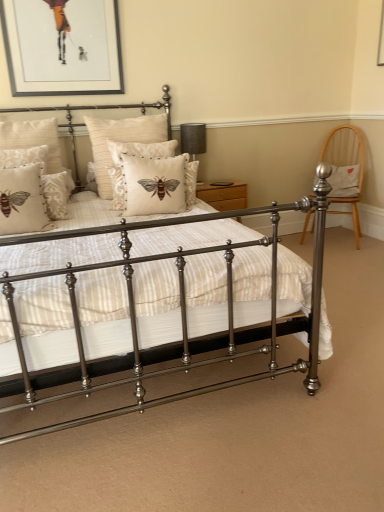
Describe the element at coordinates (120, 141) in the screenshot. This screenshot has height=512, width=384. I see `beige textured pillow with bee design at center, the third pillow positioned from the right` at that location.

Identify the location of beige textured pillow with bee design at center, the third pillow positioned from the right. (120, 141).

Image resolution: width=384 pixels, height=512 pixels. What do you see at coordinates (22, 201) in the screenshot?
I see `beige embroidered pillow at left, which is the fifth pillow from right to left` at bounding box center [22, 201].

This screenshot has height=512, width=384. Find the location of `matte wood nightstand at center`. matte wood nightstand at center is located at coordinates (224, 195).

Between black fabric table lamp at upper center and metallic bed at center, which one has smaller width?

black fabric table lamp at upper center is thinner.

Would you say black fabric table lamp at upper center contains metallic bed at center?

Definitely not — metallic bed at center is not inside black fabric table lamp at upper center.

Based on their positions, is black fabric table lamp at upper center located to the left or right of metallic bed at center?

black fabric table lamp at upper center is positioned on metallic bed at center's right side.

Which is further, (x=66, y=193) or (x=191, y=150)?

Positioned behind is point (x=191, y=150).

Is the depth of matte cream pillow at left, arranged as the 4th pillow when viewed from the right, greater than that of black fabric table lamp at upper center?

No, the depth of matte cream pillow at left, arranged as the 4th pillow when viewed from the right, is less than that of black fabric table lamp at upper center.

Considering the sizes of matte cream pillow at left, arranged as the 4th pillow when viewed from the right, and black fabric table lamp at upper center in the image, is matte cream pillow at left, arranged as the 4th pillow when viewed from the right, wider or thinner than black fabric table lamp at upper center?

In the image, matte cream pillow at left, arranged as the 4th pillow when viewed from the right, appears to be wider than black fabric table lamp at upper center.

Locate an element on the screen. table lamp that is on the right side of matte cream pillow at left, which is counted as the 4th pillow, starting from the left is located at coordinates (193, 139).

Is point (119, 126) positioned after point (242, 197)?

No, (119, 126) is closer to viewer.

Is beige textured pillow with bee design at center, which ranks as the 5th pillow in left-to-right order, completely or partially outside of matte wood nightstand at center?

beige textured pillow with bee design at center, which ranks as the 5th pillow in left-to-right order, is positioned outside matte wood nightstand at center.

Between beige textured pillow with bee design at center, the third pillow positioned from the right, and matte wood nightstand at center, which one appears on the left side from the viewer's perspective?

beige textured pillow with bee design at center, the third pillow positioned from the right.

Is beige textured pillow with bee design at center, the third pillow positioned from the right, beside matte wood nightstand at center?

No, beige textured pillow with bee design at center, the third pillow positioned from the right, is not making contact with matte wood nightstand at center.

From a real-world perspective, which object stands above the other?

beige damask pillow at left, which is the first pillow in left-to-right order, is physically above.

Does point (204, 135) come behind point (18, 134)?

Yes, point (204, 135) is behind point (18, 134).

Would you say black fabric table lamp at upper center is a long distance from beige damask pillow at left, which is the first pillow in left-to-right order?

That's right, there is a large distance between black fabric table lamp at upper center and beige damask pillow at left, which is the first pillow in left-to-right order.

Looking at their sizes, would you say black fabric table lamp at upper center is wider or thinner than beige damask pillow at left, which is the first pillow in left-to-right order?

Clearly, black fabric table lamp at upper center has less width compared to beige damask pillow at left, which is the first pillow in left-to-right order.

Considering the relative positions of black fabric table lamp at upper center and beige embroidered pillow at left, which is the fifth pillow from right to left, in the image provided, is black fabric table lamp at upper center to the right of beige embroidered pillow at left, which is the fifth pillow from right to left, from the viewer's perspective?

Yes.

Which is behind, point (182, 149) or point (0, 205)?

The point (182, 149) is farther from the camera.

From the image's perspective, which is below, black fabric table lamp at upper center or beige embroidered pillow at left, the third pillow viewed from the left?

beige embroidered pillow at left, the third pillow viewed from the left.

Is black fabric table lamp at upper center inside or outside of beige embroidered pillow at left, the third pillow viewed from the left?

The correct answer is: outside.

Is point (196, 191) positioned before point (25, 152)?

No, it is behind (25, 152).

Considering the sizes of objects matte wood nightstand at center and beige textured pillow at left, which is counted as the 2th pillow, starting from the left, in the image provided, who is taller, matte wood nightstand at center or beige textured pillow at left, which is counted as the 2th pillow, starting from the left,?

matte wood nightstand at center.

From the image's perspective, relative to beige textured pillow at left, which is the sixth pillow from right to left, is matte wood nightstand at center above or below?

matte wood nightstand at center is situated lower than beige textured pillow at left, which is the sixth pillow from right to left, in the image.

In the image, is matte wood nightstand at center positioned in front of or behind beige textured pillow at left, which is counted as the 2th pillow, starting from the left?

Clearly, matte wood nightstand at center is behind beige textured pillow at left, which is counted as the 2th pillow, starting from the left.

Is black fabric table lamp at upper center looking in the opposite direction of beige textured pillow at left, which is the sixth pillow from right to left?

No.

Considering the relative positions of black fabric table lamp at upper center and beige textured pillow at left, which is the sixth pillow from right to left, in the image provided, is black fabric table lamp at upper center to the right of beige textured pillow at left, which is the sixth pillow from right to left, from the viewer's perspective?

Correct, you'll find black fabric table lamp at upper center to the right of beige textured pillow at left, which is the sixth pillow from right to left.

Identify the location of the 4th pillow in front of the black fabric table lamp at upper center. The width and height of the screenshot is (384, 512). point(24,157).

You are a GUI agent. You are given a task and a screenshot of the screen. Output one action in this format:
    pyautogui.click(x=<x>, y=<y>)
    Task: Click on the table lamp lying behind the metallic bed at center
    
    Given the screenshot: What is the action you would take?
    pyautogui.click(x=193, y=139)

This screenshot has height=512, width=384. Identify the location of table lamp positioned vertically above the matte cream pillow at left, which is counted as the 4th pillow, starting from the left (from a real-world perspective). (193, 139).

Considering their positions, is beige damask pillow at left, arranged as the seventh pillow when viewed from the right, positioned further to beige embroidered pillow at left, the third pillow viewed from the left, than black fabric table lamp at upper center?

black fabric table lamp at upper center lies further to beige embroidered pillow at left, the third pillow viewed from the left, than the other object.

Looking at the image, which one is located closer to metallic bed at center, white fabric pillow at right, the seventh pillow when ordered from left to right, or matte cream pillow at left, arranged as the 4th pillow when viewed from the right?

Based on the image, matte cream pillow at left, arranged as the 4th pillow when viewed from the right, appears to be nearer to metallic bed at center.

Which object lies nearer to the anchor point beige embroidered pillow at left, the third pillow viewed from the left, matte cream pillow at left, which is counted as the 4th pillow, starting from the left, or metallic bed at center?

The object closer to beige embroidered pillow at left, the third pillow viewed from the left, is matte cream pillow at left, which is counted as the 4th pillow, starting from the left.

Which object lies nearer to the anchor point beige textured pillow with bee design at center, the second pillow when ordered from right to left, beige textured pillow with bee design at center, the third pillow positioned from the right, or matte wood nightstand at center?

The object closer to beige textured pillow with bee design at center, the second pillow when ordered from right to left, is beige textured pillow with bee design at center, the third pillow positioned from the right.

Estimate the real-world distances between objects in this image. Which object is further from wooden chair with cushion at right, black fabric table lamp at upper center or beige embroidered pillow at left, the third pillow viewed from the left?

The object further to wooden chair with cushion at right is beige embroidered pillow at left, the third pillow viewed from the left.

Based on their spatial positions, is beige damask pillow at left, arranged as the seventh pillow when viewed from the right, or matte wood nightstand at center further from beige textured pillow with bee design at center, the sixth pillow positioned from the left?

The object further to beige textured pillow with bee design at center, the sixth pillow positioned from the left, is matte wood nightstand at center.

From the image, which object appears to be nearer to metallic bed at center, black fabric table lamp at upper center or white fabric pillow at right, the seventh pillow when ordered from left to right?

black fabric table lamp at upper center is closer to metallic bed at center.

Based on their spatial positions, is beige damask pillow at left, which is the first pillow in left-to-right order, or white fabric pillow at right, the seventh pillow when ordered from left to right, closer to beige embroidered pillow at left, which is the fifth pillow from right to left?

Among the two, beige damask pillow at left, which is the first pillow in left-to-right order, is located nearer to beige embroidered pillow at left, which is the fifth pillow from right to left.

Identify the location of pillow situated between matte wood nightstand at center and wooden chair with cushion at right from left to right. Image resolution: width=384 pixels, height=512 pixels. (344, 181).

Locate an element on the screen. nightstand between beige textured pillow with bee design at center, the sixth pillow positioned from the left, and wooden chair with cushion at right, in the horizontal direction is located at coordinates (224, 195).

Locate an element on the screen. Image resolution: width=384 pixels, height=512 pixels. table lamp between beige textured pillow with bee design at center, which ranks as the 5th pillow in left-to-right order, and matte wood nightstand at center, along the z-axis is located at coordinates (193, 139).

The height and width of the screenshot is (512, 384). Find the location of `table lamp located between beige textured pillow at left, which is the sixth pillow from right to left, and white fabric pillow at right, the seventh pillow when ordered from left to right, in the left-right direction`. table lamp located between beige textured pillow at left, which is the sixth pillow from right to left, and white fabric pillow at right, the seventh pillow when ordered from left to right, in the left-right direction is located at coordinates (193, 139).